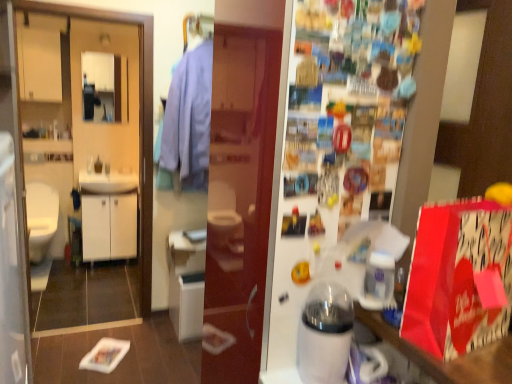
Question: Does light blue fabric shirt at center lie behind white glossy humidifier at center, the 1th appliance in the left-to-right sequence?

Choices:
 (A) yes
 (B) no

Answer: (A)

Question: Is light blue fabric shirt at center positioned with its back to white glossy humidifier at center, which ranks as the second appliance in right-to-left order?

Choices:
 (A) no
 (B) yes

Answer: (A)

Question: Does light blue fabric shirt at center have a greater height compared to white glossy humidifier at center, which ranks as the second appliance in right-to-left order?

Choices:
 (A) yes
 (B) no

Answer: (A)

Question: Can you confirm if light blue fabric shirt at center is thinner than white glossy humidifier at center, the 1th appliance in the left-to-right sequence?

Choices:
 (A) no
 (B) yes

Answer: (A)

Question: Is light blue fabric shirt at center with white glossy humidifier at center, the 1th appliance in the left-to-right sequence?

Choices:
 (A) yes
 (B) no

Answer: (B)

Question: Is point (86, 225) positioned closer to the camera than point (55, 228)?

Choices:
 (A) closer
 (B) farther

Answer: (A)

Question: Is white matte cabinet at left, which ranks as the first cabinetry in right-to-left order, spatially inside white glossy toilet at left, or outside of it?

Choices:
 (A) inside
 (B) outside

Answer: (B)

Question: In terms of height, does white matte cabinet at left, which ranks as the first cabinetry in right-to-left order, look taller or shorter compared to white glossy toilet at left?

Choices:
 (A) short
 (B) tall

Answer: (A)

Question: Considering the positions of white matte cabinet at left, which is counted as the 2th cabinetry, starting from the top, and white glossy toilet at left in the image, is white matte cabinet at left, which is counted as the 2th cabinetry, starting from the top, bigger or smaller than white glossy toilet at left?

Choices:
 (A) small
 (B) big

Answer: (A)

Question: Based on their sizes in the image, would you say white matte cabinet at left, which is counted as the 2th cabinetry, starting from the top, is bigger or smaller than light blue fabric shirt at center?

Choices:
 (A) big
 (B) small

Answer: (B)

Question: Is white matte cabinet at left, which ranks as the first cabinetry in right-to-left order, taller or shorter than light blue fabric shirt at center?

Choices:
 (A) tall
 (B) short

Answer: (B)

Question: Relative to light blue fabric shirt at center, is white matte cabinet at left, which is counted as the 2th cabinetry, starting from the top, in front or behind?

Choices:
 (A) front
 (B) behind

Answer: (B)

Question: From a real-world perspective, is white matte cabinet at left, which is counted as the 2th cabinetry, starting from the top, physically located above or below light blue fabric shirt at center?

Choices:
 (A) below
 (B) above

Answer: (A)

Question: Is matte white cabinet at upper left, which is the first cabinetry in left-to-right order, bigger or smaller than light blue fabric shirt at center?

Choices:
 (A) big
 (B) small

Answer: (B)

Question: From the image's perspective, is matte white cabinet at upper left, which is the first cabinetry in left-to-right order, located above or below light blue fabric shirt at center?

Choices:
 (A) below
 (B) above

Answer: (B)